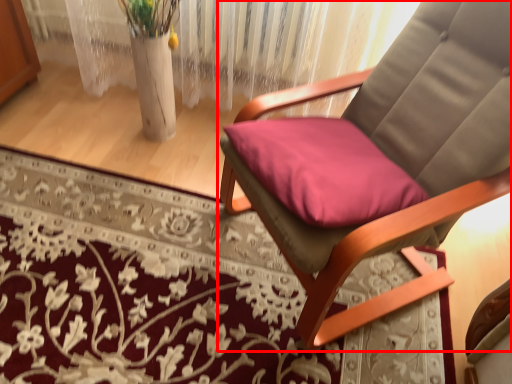
Question: From the image's perspective, what is the correct spatial positioning of chair (annotated by the red box) in reference to mat?

Choices:
 (A) above
 (B) below

Answer: (A)